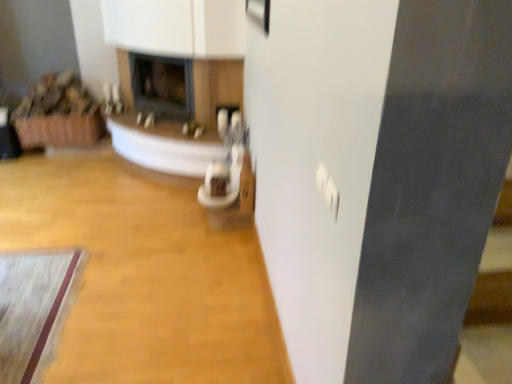
Identify the location of matte black fireplace at center, the first fireplace when ordered from left to right. (162, 85).

The image size is (512, 384). Find the location of `matte black fireplace at center, the 2th fireplace from the right`. matte black fireplace at center, the 2th fireplace from the right is located at coordinates (162, 85).

Can you tell me how much matte black fireplace at center, the first fireplace when ordered from left to right, and wooden floor at center differ in facing direction?

There is a 135-degree angle between the facing directions of matte black fireplace at center, the first fireplace when ordered from left to right, and wooden floor at center.

Is the position of matte black fireplace at center, the first fireplace when ordered from left to right, more distant than that of wooden floor at center?

Yes, it is behind wooden floor at center.

From the image's perspective, is matte black fireplace at center, the 2th fireplace from the right, under wooden floor at center?

Actually, matte black fireplace at center, the 2th fireplace from the right, appears above wooden floor at center in the image.

Can wooden floor at center be found inside matte black fireplace at center, the 2th fireplace from the right?

No, wooden floor at center is not inside matte black fireplace at center, the 2th fireplace from the right.

Is matte black fireplace at center, acting as the first fireplace starting from the right, not within wooden floor at center?

Absolutely, matte black fireplace at center, acting as the first fireplace starting from the right, is external to wooden floor at center.

Can you confirm if matte black fireplace at center, the second fireplace positioned from the left, is bigger than wooden floor at center?

No.

Is point (220, 152) closer or farther from the camera than point (73, 197)?

Point (220, 152) is closer to the camera than point (73, 197).

How distant is wooden floor at center from matte black fireplace at center, the first fireplace when ordered from left to right?

A distance of 37.99 inches exists between wooden floor at center and matte black fireplace at center, the first fireplace when ordered from left to right.

Is point (178, 316) farther from camera compared to point (182, 60)?

That is False.

Is wooden floor at center not near matte black fireplace at center, the 2th fireplace from the right?

No, wooden floor at center is not far away from matte black fireplace at center, the 2th fireplace from the right.

How many degrees apart are the facing directions of matte black fireplace at center, the second fireplace positioned from the left, and matte black fireplace at center, the 2th fireplace from the right?

There is a 6.77e-05-degree angle between the facing directions of matte black fireplace at center, the second fireplace positioned from the left, and matte black fireplace at center, the 2th fireplace from the right.

I want to click on fireplace below the matte black fireplace at center, the second fireplace positioned from the left (from a real-world perspective), so click(x=162, y=85).

From the image's perspective, does matte black fireplace at center, acting as the first fireplace starting from the right, appear lower than matte black fireplace at center, the 2th fireplace from the right?

Correct, matte black fireplace at center, acting as the first fireplace starting from the right, appears lower than matte black fireplace at center, the 2th fireplace from the right, in the image.

Does matte black fireplace at center, the second fireplace positioned from the left, have a greater width compared to matte black fireplace at center, the 2th fireplace from the right?

Indeed, matte black fireplace at center, the second fireplace positioned from the left, has a greater width compared to matte black fireplace at center, the 2th fireplace from the right.

Based on the photo, from a real-world perspective, which object rests below the other?

matte black fireplace at center, the first fireplace when ordered from left to right, from a real-world perspective.

In the image, is matte black fireplace at center, the 2th fireplace from the right, positioned in front of or behind matte black fireplace at center, acting as the first fireplace starting from the right?

Clearly, matte black fireplace at center, the 2th fireplace from the right, is behind matte black fireplace at center, acting as the first fireplace starting from the right.

Could you tell me if matte black fireplace at center, the first fireplace when ordered from left to right, is facing matte black fireplace at center, acting as the first fireplace starting from the right?

Yes, matte black fireplace at center, the first fireplace when ordered from left to right, is aimed at matte black fireplace at center, acting as the first fireplace starting from the right.

Are wooden floor at center and matte black fireplace at center, acting as the first fireplace starting from the right, far apart?

Actually, wooden floor at center and matte black fireplace at center, acting as the first fireplace starting from the right, are a little close together.

Is wooden floor at center at the left side of matte black fireplace at center, acting as the first fireplace starting from the right?

Yes, wooden floor at center is to the left of matte black fireplace at center, acting as the first fireplace starting from the right.

Could you measure the distance between wooden floor at center and matte black fireplace at center, the second fireplace positioned from the left?

wooden floor at center is 67.19 centimeters from matte black fireplace at center, the second fireplace positioned from the left.

Between wooden floor at center and matte black fireplace at center, the second fireplace positioned from the left, which one has smaller size?

matte black fireplace at center, the second fireplace positioned from the left, is smaller.

Locate an element on the screen. plain below the matte black fireplace at center, the first fireplace when ordered from left to right (from a real-world perspective) is located at coordinates (146, 274).

Locate an element on the screen. fireplace that is the 1st object located behind the wooden floor at center is located at coordinates (177, 121).

Based on their spatial positions, is matte black fireplace at center, the second fireplace positioned from the left, or matte black fireplace at center, the 2th fireplace from the right, closer to wooden floor at center?

Based on the image, matte black fireplace at center, the second fireplace positioned from the left, appears to be nearer to wooden floor at center.

When comparing their distances from matte black fireplace at center, the second fireplace positioned from the left, does wooden floor at center or matte black fireplace at center, the first fireplace when ordered from left to right, seem closer?

Based on the image, matte black fireplace at center, the first fireplace when ordered from left to right, appears to be nearer to matte black fireplace at center, the second fireplace positioned from the left.

Looking at the image, which one is located closer to matte black fireplace at center, acting as the first fireplace starting from the right, matte black fireplace at center, the 2th fireplace from the right, or wooden floor at center?

matte black fireplace at center, the 2th fireplace from the right.

When comparing their distances from matte black fireplace at center, the 2th fireplace from the right, does matte black fireplace at center, acting as the first fireplace starting from the right, or wooden floor at center seem closer?

matte black fireplace at center, acting as the first fireplace starting from the right, is positioned closer to the anchor matte black fireplace at center, the 2th fireplace from the right.

Considering their positions, is matte black fireplace at center, the 2th fireplace from the right, positioned further to wooden floor at center than matte black fireplace at center, the second fireplace positioned from the left?

matte black fireplace at center, the 2th fireplace from the right, is further to wooden floor at center.

Considering their positions, is wooden floor at center positioned closer to matte black fireplace at center, the 2th fireplace from the right, than matte black fireplace at center, acting as the first fireplace starting from the right?

matte black fireplace at center, acting as the first fireplace starting from the right.

Where is `fireplace positioned between wooden floor at center and matte black fireplace at center, the 2th fireplace from the right, from near to far`? fireplace positioned between wooden floor at center and matte black fireplace at center, the 2th fireplace from the right, from near to far is located at coordinates (177, 121).